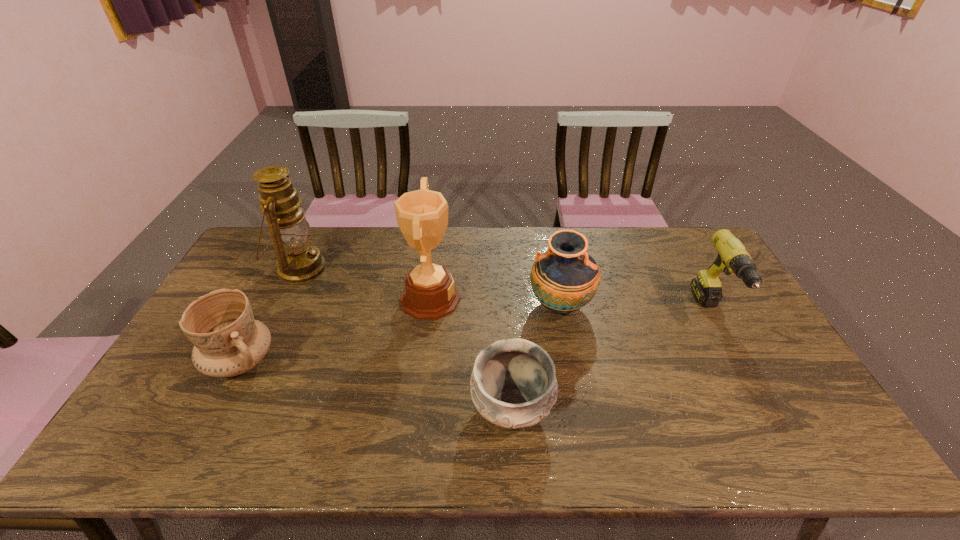
The width and height of the screenshot is (960, 540). In the image, there is a desktop. In order to click on free space at the near edge in this screenshot , I will do `click(537, 460)`.

Locate an element on the screen. The width and height of the screenshot is (960, 540). vacant space at the left edge of the desktop is located at coordinates (175, 380).

You are a GUI agent. You are given a task and a screenshot of the screen. Output one action in this format:
    pyautogui.click(x=<x>, y=<y>)
    Task: Click on the vacant position at the right edge of the desktop
    Image resolution: width=960 pixels, height=540 pixels.
    Given the screenshot: What is the action you would take?
    [x=826, y=426]

Image resolution: width=960 pixels, height=540 pixels. Find the location of `free space at the far left corner`. free space at the far left corner is located at coordinates (263, 234).

Locate an element on the screen. free point between the shortest pottery and the second shortest object is located at coordinates (376, 385).

At what (x,y) coordinates should I click in order to perform the action: click on vacant space that is in between the oil lamp and the rightmost object. Please return your answer as a coordinate pair (x, y). Looking at the image, I should click on (506, 291).

At what (x,y) coordinates should I click in order to perform the action: click on vacant space that's between the oil lamp and the drill. Please return your answer as a coordinate pair (x, y). Looking at the image, I should click on (506, 291).

You are a GUI agent. You are given a task and a screenshot of the screen. Output one action in this format:
    pyautogui.click(x=<x>, y=<y>)
    Task: Click on the vacant space that's between the shortest object and the second tallest pottery
    
    Given the screenshot: What is the action you would take?
    pyautogui.click(x=376, y=385)

This screenshot has width=960, height=540. I want to click on free space between the oil lamp and the award, so click(365, 284).

Find the location of a particular element. unoccupied position between the shortest pottery and the second shortest object is located at coordinates (376, 385).